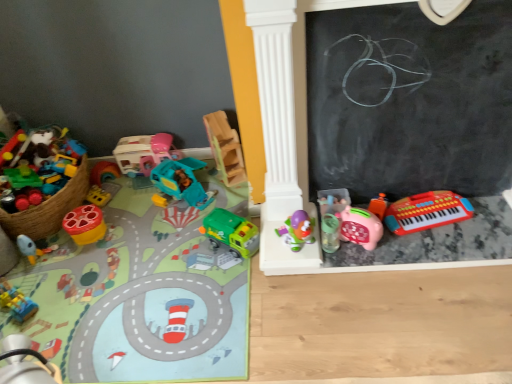
Image resolution: width=512 pixels, height=384 pixels. Identify the location of vacant area that lies between teal plastic car at center, marked as the 7th toy in a right-to-left arrangement, and plastic yellow car at lower left, positioned as the 2th toy in left-to-right order. (106, 248).